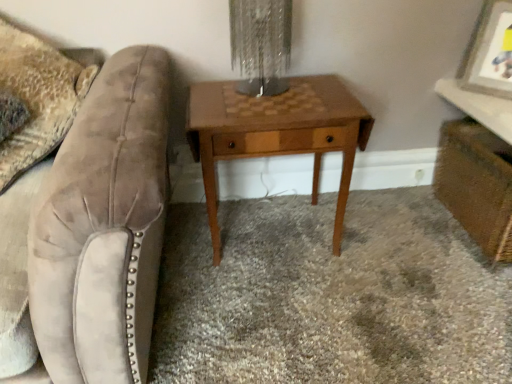
The height and width of the screenshot is (384, 512). I want to click on free space that is to the left of metallic textured lampshade at center, so click(210, 96).